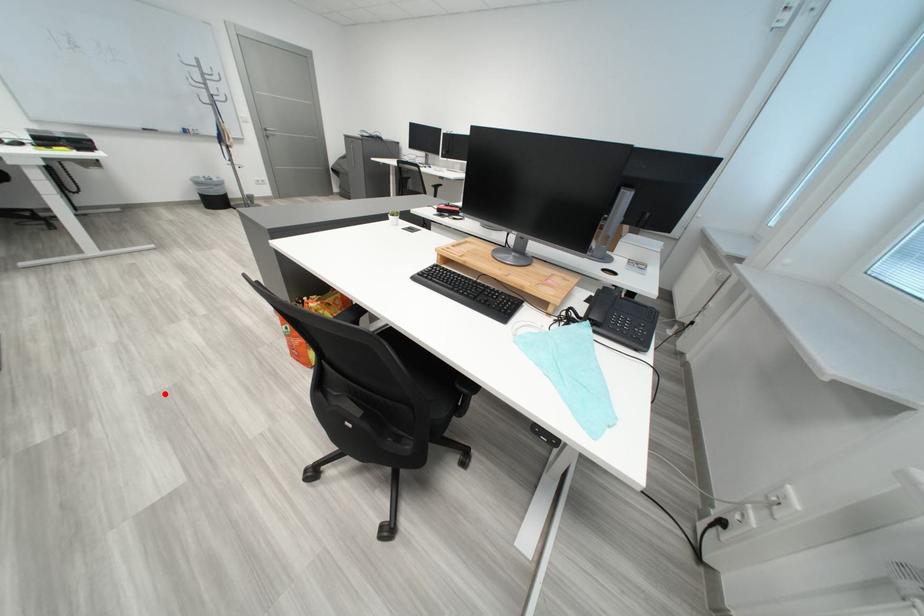
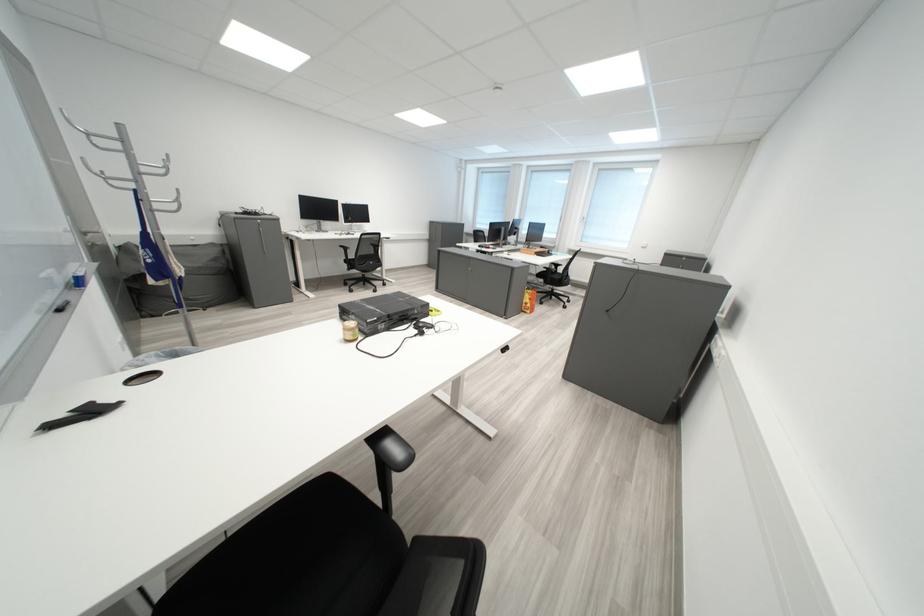
Question: I am providing you with two images of the same scene from different viewpoints. Image1 has a red point marked. In image2, the corresponding 3D location appears at what relative position? Reply with the corresponding letter.

Choices:
 (A) Closer
 (B) Farther

Answer: (B)